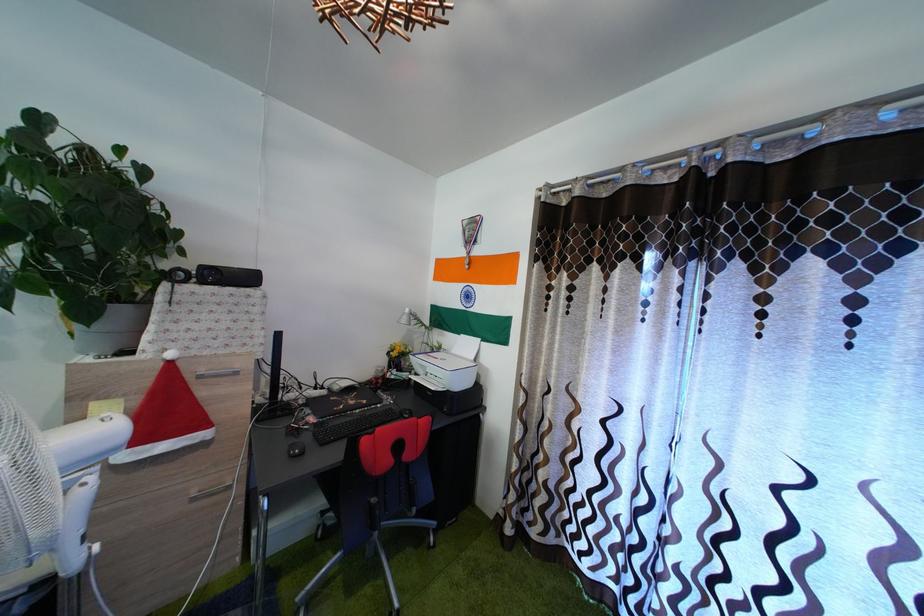
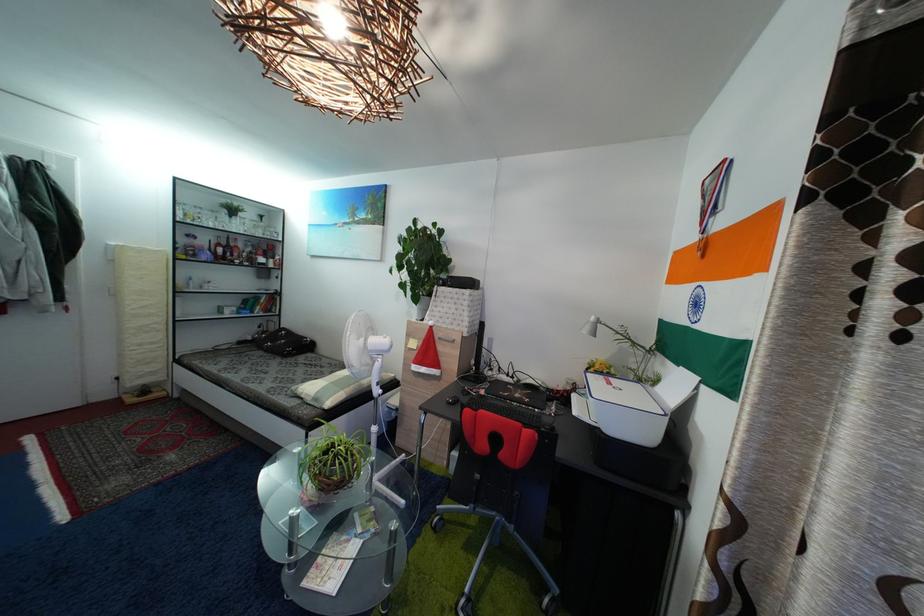
Find the pixel in the second image that matches point 155,345 in the first image.

(435, 321)